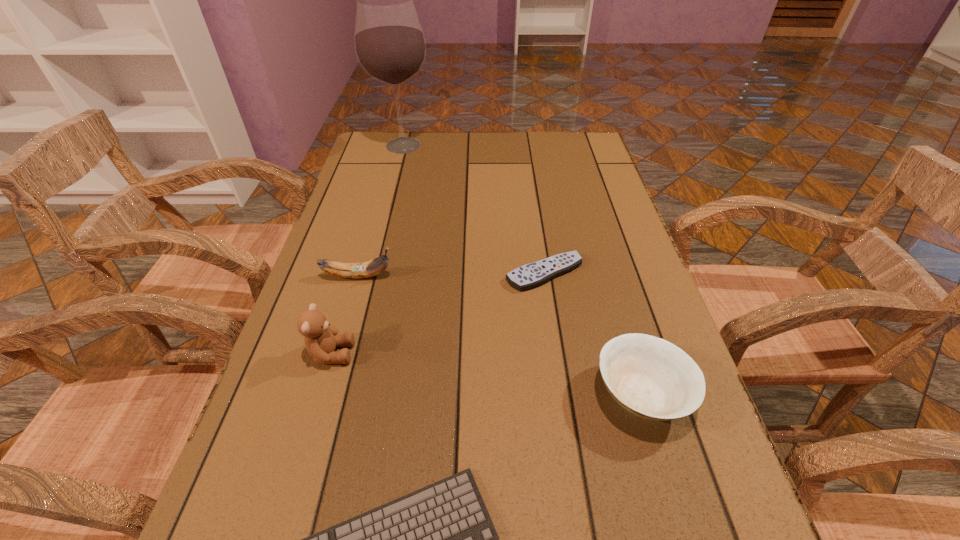
Where is `alcohol`? The image size is (960, 540). alcohol is located at coordinates (390, 46).

The width and height of the screenshot is (960, 540). Identify the location of the tallest object. (390, 46).

Find the location of a particular element. This screenshot has width=960, height=540. teddy bear is located at coordinates (321, 339).

Locate an element on the screen. This screenshot has width=960, height=540. banana is located at coordinates (373, 267).

You are a GUI agent. You are given a task and a screenshot of the screen. Output one action in this format:
    pyautogui.click(x=<x>, y=<y>)
    Task: Click on the third shortest object
    The width and height of the screenshot is (960, 540).
    Given the screenshot: What is the action you would take?
    pyautogui.click(x=650, y=377)

The width and height of the screenshot is (960, 540). What are the coordinates of `the fifth tallest object` in the screenshot? It's located at (528, 276).

The height and width of the screenshot is (540, 960). Find the location of `free point located 0.110m on the front of the farthest object`. free point located 0.110m on the front of the farthest object is located at coordinates (395, 180).

Where is `vacant space located 0.360m on the face of the second tallest object`? The height and width of the screenshot is (540, 960). vacant space located 0.360m on the face of the second tallest object is located at coordinates point(544,353).

The height and width of the screenshot is (540, 960). I want to click on vacant area situated at the stem of the fourth shortest object, so click(516, 276).

The image size is (960, 540). What are the coordinates of `vacant region located 0.400m on the left of the fourth tallest object` in the screenshot? It's located at (364, 394).